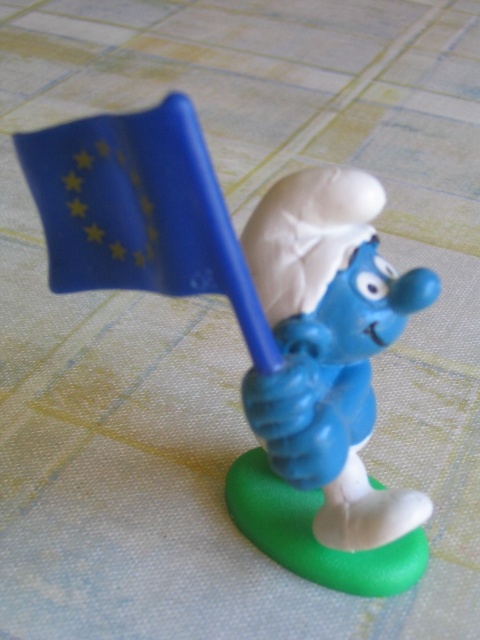
Question: Is blue plastic smurf at center smaller than blue matte flag at upper center?

Choices:
 (A) no
 (B) yes

Answer: (A)

Question: Which point is farther to the camera?

Choices:
 (A) blue matte flag at upper center
 (B) blue matte smurf at center
 (C) blue plastic smurf at center

Answer: (B)

Question: Can you confirm if blue plastic smurf at center is thinner than blue matte flag at upper center?

Choices:
 (A) yes
 (B) no

Answer: (B)

Question: Is blue plastic smurf at center closer to camera compared to blue matte smurf at center?

Choices:
 (A) yes
 (B) no

Answer: (A)

Question: Which point is farther from the camera taking this photo?

Choices:
 (A) (162, 136)
 (B) (256, 268)
 (C) (274, 260)

Answer: (B)

Question: Which point is closer to the camera?

Choices:
 (A) (148, 129)
 (B) (354, 500)
 (C) (367, 352)

Answer: (A)